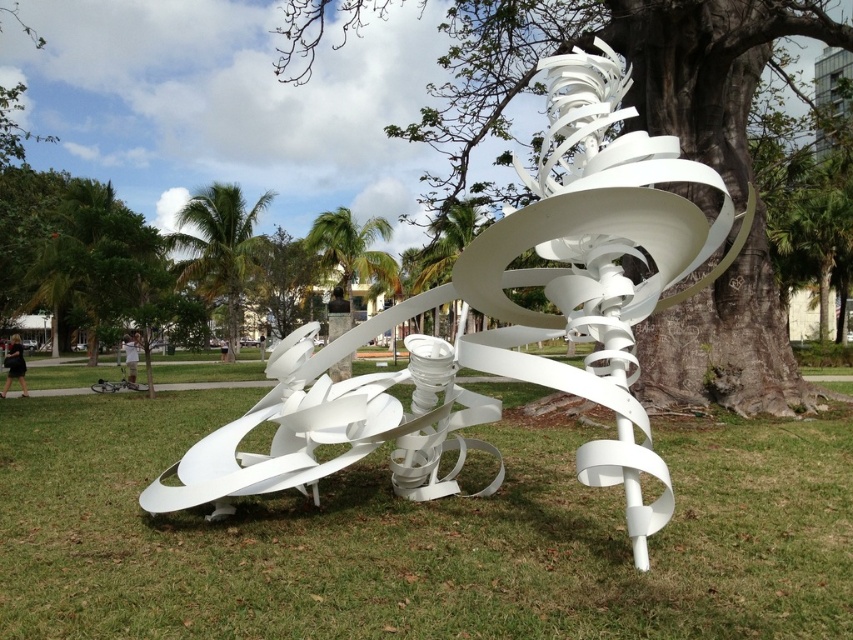
Which is more to the right, white matte sculpture at center or green leafy palm tree at upper left?

white matte sculpture at center is more to the right.

Which is above, white matte sculpture at center or green leafy palm tree at upper left?

Positioned higher is green leafy palm tree at upper left.

The height and width of the screenshot is (640, 853). Describe the element at coordinates (502, 320) in the screenshot. I see `white matte sculpture at center` at that location.

You are a GUI agent. You are given a task and a screenshot of the screen. Output one action in this format:
    pyautogui.click(x=<x>, y=<y>)
    Task: Click on the white matte sculpture at center
    
    Given the screenshot: What is the action you would take?
    pyautogui.click(x=502, y=320)

Who is more forward, (x=676, y=301) or (x=724, y=131)?

Point (x=676, y=301) is more forward.

How far apart are white matte sculpture at center and brown textured tree at center?

5.95 meters

Which is behind, point (666, 259) or point (715, 342)?

The point (715, 342) is behind.

This screenshot has height=640, width=853. I want to click on white matte sculpture at center, so click(502, 320).

Is point (601, 548) less distant than point (318, 396)?

Yes, it is in front of point (318, 396).

Can you confirm if green grass at center is positioned below white matte sculpture at center?

Indeed, green grass at center is positioned under white matte sculpture at center.

Who is more distant from viewer, (x=579, y=490) or (x=312, y=376)?

The point (x=579, y=490) is more distant.

This screenshot has width=853, height=640. Identify the location of green grass at center. (x=421, y=534).